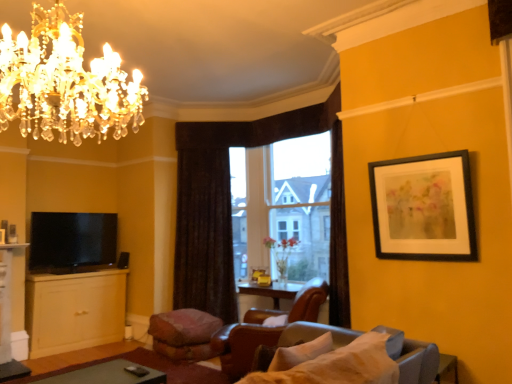
This screenshot has width=512, height=384. What are the coordinates of `black matte picture frame at upper right` in the screenshot? It's located at (424, 208).

What do you see at coordinates (98, 375) in the screenshot? I see `green matte table at lower left` at bounding box center [98, 375].

This screenshot has height=384, width=512. I want to click on green matte table at lower left, so click(x=98, y=375).

In order to face dark brown textured curtain at center, should I rotate leftwards or rightwards?

Turn left by 6.842 degrees to look at dark brown textured curtain at center.

This screenshot has width=512, height=384. Describe the element at coordinates (65, 82) in the screenshot. I see `crystal gold chandelier at upper left` at that location.

Measure the distance between point (322, 198) and camera.

The depth of point (322, 198) is 16.75 feet.

The width and height of the screenshot is (512, 384). What do you see at coordinates (282, 205) in the screenshot? I see `transparent glass window at center` at bounding box center [282, 205].

At what (x,y) coordinates should I click in order to perform the action: click on black matte picture frame at upper right. Please return your answer as a coordinate pair (x, y). Looking at the image, I should click on (424, 208).

Would you consider pink fabric footrest at lower center to be distant from leather at center?

They are positioned close to each other.

Where is `chair on the right of pink fabric footrest at lower center`? This screenshot has height=384, width=512. chair on the right of pink fabric footrest at lower center is located at coordinates (244, 342).

How far apart are pink fabric footrest at lower center and leather at center?

pink fabric footrest at lower center is 29.93 inches from leather at center.

Can you confirm if pink fabric footrest at lower center is positioned to the left of leather at center?

Indeed, pink fabric footrest at lower center is positioned on the left side of leather at center.

What are the coordinates of `footrest in front of the matte yellow cabinet at lower left` in the screenshot? It's located at (184, 334).

Is point (203, 320) behind point (77, 305)?

That is False.

Is pink fabric footrest at lower center oriented away from matte yellow cabinet at lower left?

pink fabric footrest at lower center is not turned away from matte yellow cabinet at lower left.

Which of these two, pink fabric footrest at lower center or matte yellow cabinet at lower left, stands taller?

matte yellow cabinet at lower left is taller.

From the image's perspective, which object appears higher, dark brown textured curtain at center or matte black tv at lower left?

dark brown textured curtain at center.

Would you say dark brown textured curtain at center is inside or outside matte black tv at lower left?

dark brown textured curtain at center exists outside the volume of matte black tv at lower left.

From a real-world perspective, who is located higher, dark brown textured curtain at center or matte black tv at lower left?

dark brown textured curtain at center, from a real-world perspective.

Which is behind, dark brown textured curtain at center or matte black tv at lower left?

dark brown textured curtain at center.

Locate an element on the screen. window lying above the green matte table at lower left (from the image's perspective) is located at coordinates (282, 205).

Are green matte table at lower left and transparent glass window at center far apart?

green matte table at lower left is far away from transparent glass window at center.

Which object is further away from the camera taking this photo, green matte table at lower left or transparent glass window at center?

transparent glass window at center is further away from the camera.

Considering the relative sizes of green matte table at lower left and transparent glass window at center in the image provided, is green matte table at lower left bigger than transparent glass window at center?

No.

Are crystal gold chandelier at upper left and green matte table at lower left beside each other?

No, crystal gold chandelier at upper left is not making contact with green matte table at lower left.

Considering the sizes of objects crystal gold chandelier at upper left and green matte table at lower left in the image provided, who is wider, crystal gold chandelier at upper left or green matte table at lower left?

crystal gold chandelier at upper left.

Where is `chandelier lying above the green matte table at lower left (from the image's perspective)`? chandelier lying above the green matte table at lower left (from the image's perspective) is located at coordinates (65, 82).

From the picture: Does crystal gold chandelier at upper left have a larger size compared to green matte table at lower left?

Yes, crystal gold chandelier at upper left is bigger than green matte table at lower left.

From the image's perspective, is crystal gold chandelier at upper left over transparent glass window at center?

Yes, from the image's perspective, crystal gold chandelier at upper left is over transparent glass window at center.

Looking at their sizes, would you say crystal gold chandelier at upper left is wider or thinner than transparent glass window at center?

crystal gold chandelier at upper left is wider than transparent glass window at center.

Considering the relative sizes of crystal gold chandelier at upper left and transparent glass window at center in the image provided, is crystal gold chandelier at upper left taller than transparent glass window at center?

No.

Consider the image. Is crystal gold chandelier at upper left far from transparent glass window at center?

Yes, crystal gold chandelier at upper left and transparent glass window at center are located far from each other.

Does dark brown textured curtain at center have a lesser width compared to green matte table at lower left?

Correct, the width of dark brown textured curtain at center is less than that of green matte table at lower left.

Between dark brown textured curtain at center and green matte table at lower left, which one has smaller size?

Smaller between the two is green matte table at lower left.

Where is `table below the dark brown textured curtain at center (from a real-world perspective)`? table below the dark brown textured curtain at center (from a real-world perspective) is located at coordinates (98, 375).

From the image's perspective, is dark brown textured curtain at center above or below green matte table at lower left?

dark brown textured curtain at center is situated higher than green matte table at lower left in the image.

Where is `footrest located on the left of leather at center`? This screenshot has width=512, height=384. footrest located on the left of leather at center is located at coordinates (184, 334).

At what (x,y) coordinates should I click in order to perform the action: click on the footrest located below the matte yellow cabinet at lower left (from the image's perspective). Please return your answer as a coordinate pair (x, y). The image size is (512, 384). Looking at the image, I should click on (184, 334).

From the image, which object appears to be nearer to transparent glass window at center, crystal gold chandelier at upper left or pink fabric footrest at lower center?

Among the two, pink fabric footrest at lower center is located nearer to transparent glass window at center.

Which object lies further to the anchor point matte black tv at lower left, crystal gold chandelier at upper left or green matte table at lower left?

crystal gold chandelier at upper left lies further to matte black tv at lower left than the other object.

Which object lies nearer to the anchor point pink fabric footrest at lower center, transparent glass window at center or matte yellow cabinet at lower left?

The object closer to pink fabric footrest at lower center is matte yellow cabinet at lower left.

When comparing their distances from dark brown textured curtain at center, does matte yellow cabinet at lower left or transparent glass window at center seem closer?

→ transparent glass window at center lies closer to dark brown textured curtain at center than the other object.

From the image, which object appears to be farther from transparent glass window at center, matte yellow cabinet at lower left or dark brown textured curtain at center?

matte yellow cabinet at lower left is positioned further to the anchor transparent glass window at center.

Considering their positions, is transparent glass window at center positioned closer to matte yellow cabinet at lower left than green matte table at lower left?

green matte table at lower left lies closer to matte yellow cabinet at lower left than the other object.

From the picture: Looking at the image, which one is located further to matte yellow cabinet at lower left, leather at center or transparent glass window at center?

leather at center.

Considering their positions, is dark brown textured curtain at center positioned closer to transparent glass window at center than matte yellow cabinet at lower left?

Based on the image, dark brown textured curtain at center appears to be nearer to transparent glass window at center.

The width and height of the screenshot is (512, 384). In order to click on television between crystal gold chandelier at upper left and dark brown textured curtain at center in the front-back direction in this screenshot , I will do `click(71, 241)`.

Identify the location of television situated between matte yellow cabinet at lower left and black matte picture frame at upper right from left to right. (71, 241).

Find the location of `picture frame between crystal gold chandelier at upper left and pink fabric footrest at lower center from front to back`. picture frame between crystal gold chandelier at upper left and pink fabric footrest at lower center from front to back is located at coordinates (424, 208).

Locate an element on the screen. footrest between green matte table at lower left and black matte picture frame at upper right is located at coordinates (184, 334).